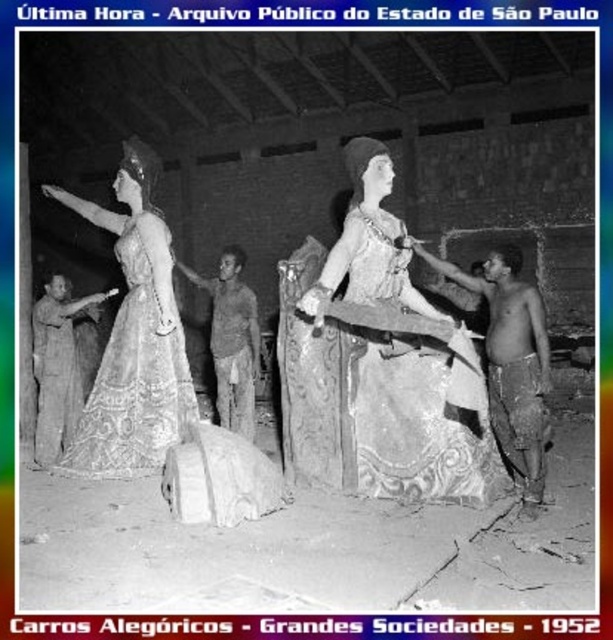
Who is higher up, brown fabric shirt at left or brown textured fabric at center?

brown textured fabric at center is above.

What do you see at coordinates (58, 365) in the screenshot? Image resolution: width=613 pixels, height=640 pixels. I see `brown fabric shirt at left` at bounding box center [58, 365].

At what (x,y) coordinates should I click in order to perform the action: click on brown fabric shirt at left. Please return your answer as a coordinate pair (x, y). This screenshot has width=613, height=640. Looking at the image, I should click on (58, 365).

Does matte fabric dress at center appear under brown fabric shirt at left?

No.

Is the position of matte fabric dress at center less distant than that of brown fabric shirt at left?

Yes, it is.

Is point (392, 406) positioned in front of point (55, 438)?

Yes, it is.

Where is `matte fabric dress at center`? matte fabric dress at center is located at coordinates (371, 390).

Does matte fabric dress at center appear under matte gold dress at left?

Yes.

Measure the distance from matte fabric dress at center to matte gold dress at left.

matte fabric dress at center is 4.19 feet away from matte gold dress at left.

Identify the location of matte fabric dress at center. The height and width of the screenshot is (640, 613). (371, 390).